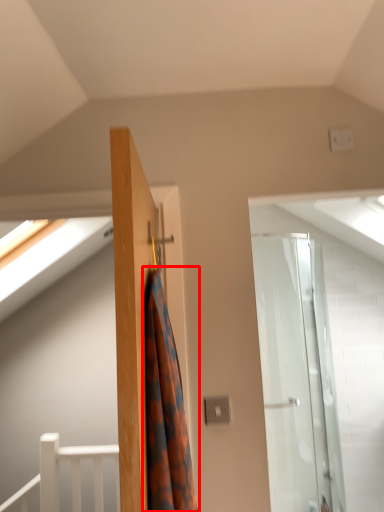
Question: Observing the image, what is the correct spatial positioning of shower curtain (annotated by the red box) in reference to rail?

Choices:
 (A) left
 (B) right

Answer: (B)